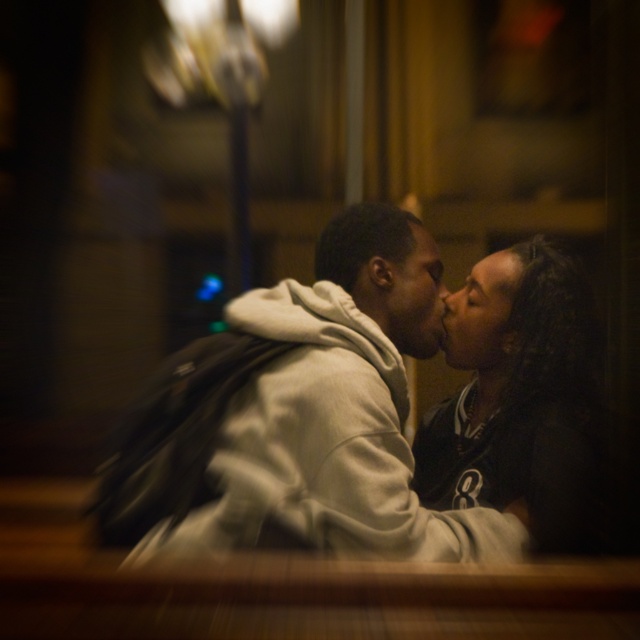
You are an event planner organizing a photo shoot and need to position a spotlight. The spotlight can only illuminate objects within a 0.5 unit radius from its position. If you place the spotlight at coordinates point A, which is at position 0.5, 0.5, will it illuminate the dark blue jersey at center?

The dark blue jersey at center is located at point (522, 406). The distance between point A (320, 320) and the jersey is sqrt of squared differences in x and y coordinates. Calculating sqrt of 0.136 squared plus 0.316 squared equals sqrt of 0.0185 plus 0.100 equals sqrt of 0.1185 which is approximately 0.344 units. Since 0.344 is less than 0.5, the spotlight will illuminate the dark blue jersey at center.

You are standing in the same room as the two people in the image. You want to place a small gift between them so that it is closer to the person on the right. Which point should you aim for, point 1 at coordinates (x=380, y=340) or point 2 at (x=529, y=307)?

Point 1 at coordinates (x=380, y=340) is in front of point 2 at (x=529, y=307). To place the gift closer to the person on the right, aim for point 1 at coordinates (x=380, y=340) since it is closer to them.

You are a photographer who wants to capture the exact point where the dark blue jersey at center is located in the image. Using the coordinate system where the bottom left corner is the origin, can you confirm if the point at coordinate (522, 406) falls on the dark blue jersey at center?

Yes, the point at coordinate (522, 406) is on the dark blue jersey at center according to the description provided.